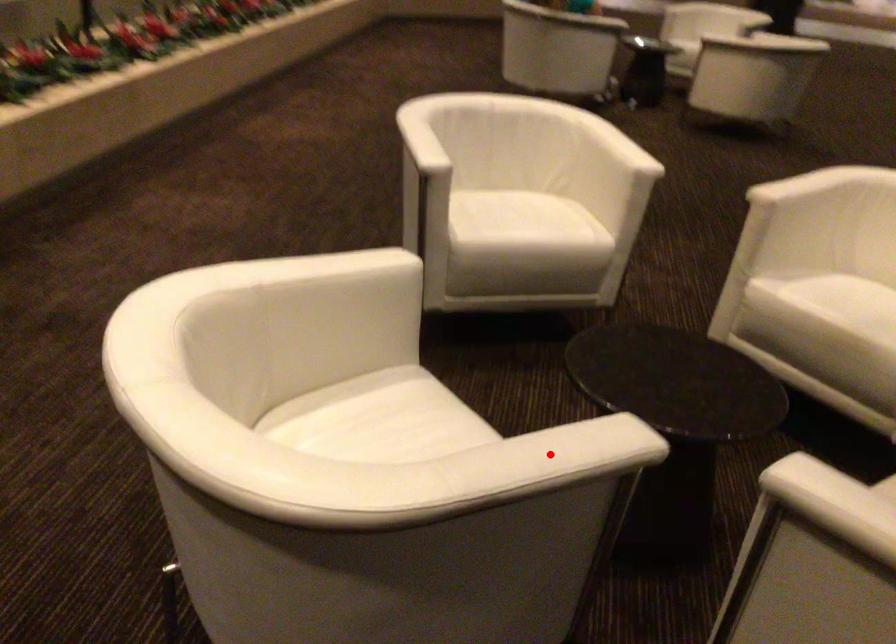
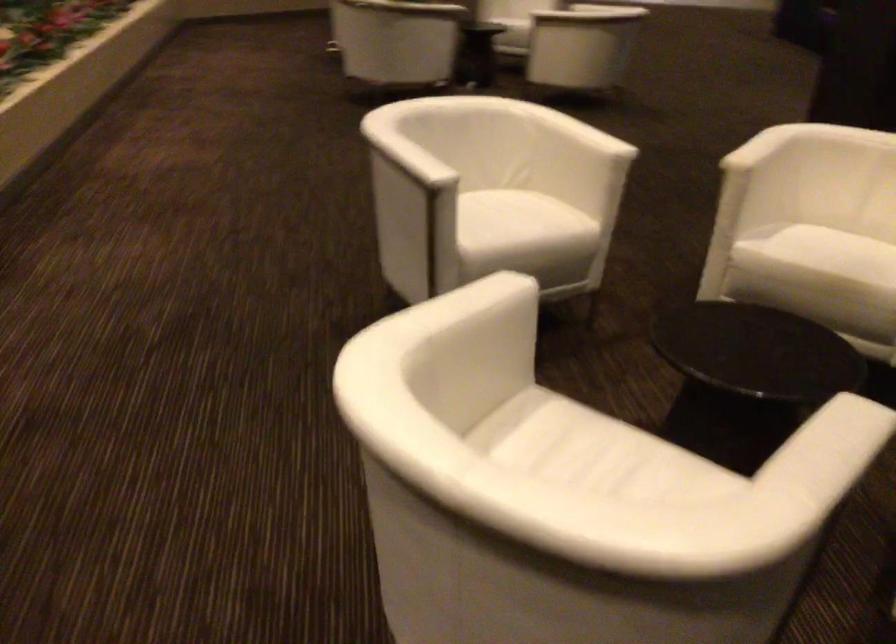
Where in the second image is the point corresponding to the highlighted location from the first image?

(839, 446)